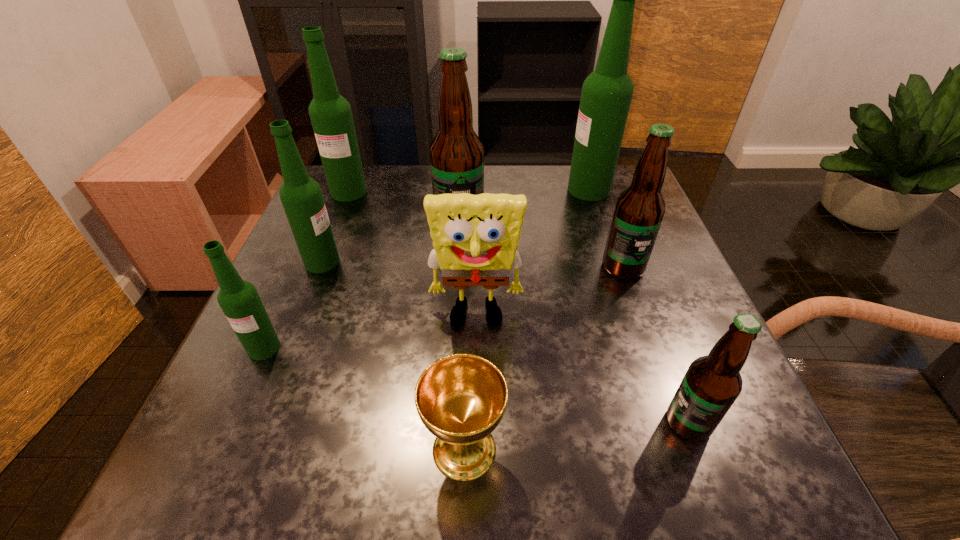
Find the location of a particular element. vacant position located 0.200m on the label of the second smallest brown beer bottle is located at coordinates (658, 366).

Identify the location of vacant space situated on the face of the sponge. pyautogui.click(x=475, y=450).

Locate an element on the screen. The width and height of the screenshot is (960, 540). vacant region located on the label of the smallest brown beer bottle is located at coordinates (497, 422).

Locate an element on the screen. vacant space located on the label of the smallest brown beer bottle is located at coordinates (491, 422).

Locate an element on the screen. The image size is (960, 540). vacant region located 0.250m on the label of the smallest brown beer bottle is located at coordinates (497, 422).

Identify the location of vacant space located on the label of the nearest green beer bottle. This screenshot has height=540, width=960. (216, 454).

Identify the location of vacant space located on the back of the shortest object. Image resolution: width=960 pixels, height=540 pixels. (469, 255).

The width and height of the screenshot is (960, 540). Identify the location of beer bottle at the near edge. (712, 383).

I want to click on chalice that is at the near edge, so click(461, 398).

The image size is (960, 540). I want to click on object at the far left corner, so click(x=331, y=116).